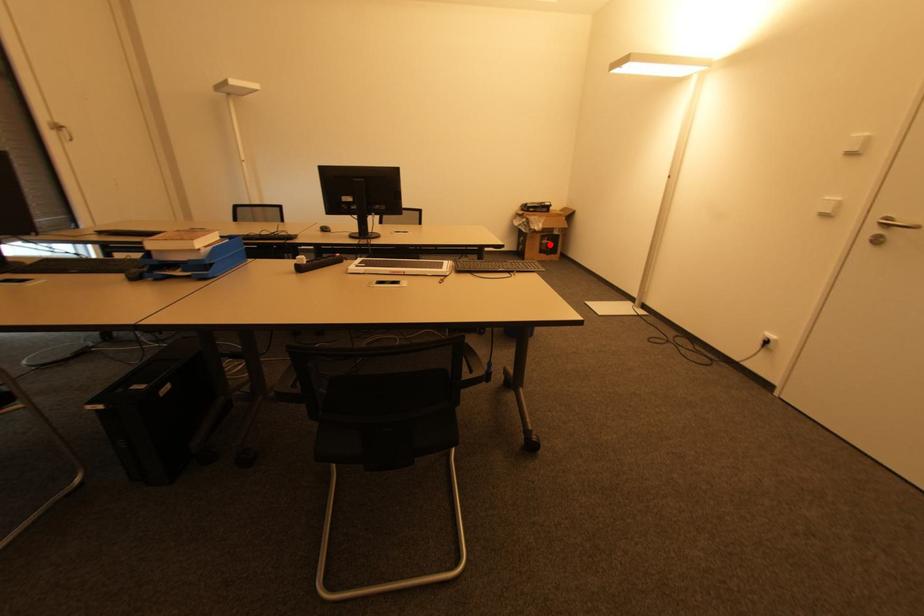
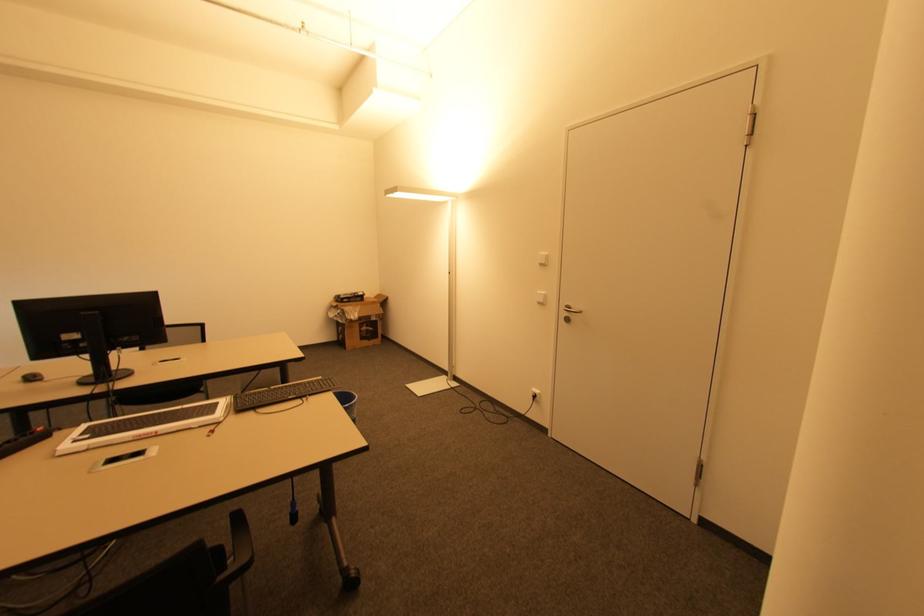
Question: I am providing you with two images of the same scene from different viewpoints. A red point is marked on the first image. Can you still see the location of the red point in image 2?

Choices:
 (A) Yes
 (B) No

Answer: (A)